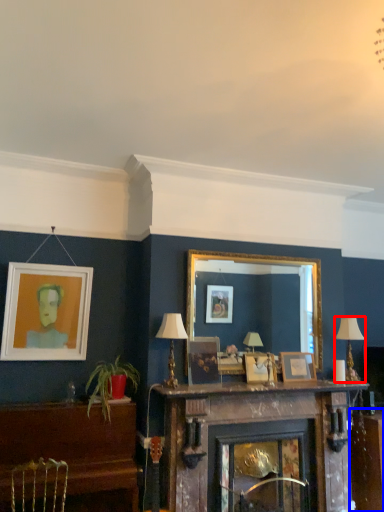
Question: Which object appears closest to the camera in this image, lamp (highlighted by a red box) or table (highlighted by a blue box)?

Choices:
 (A) lamp
 (B) table

Answer: (A)